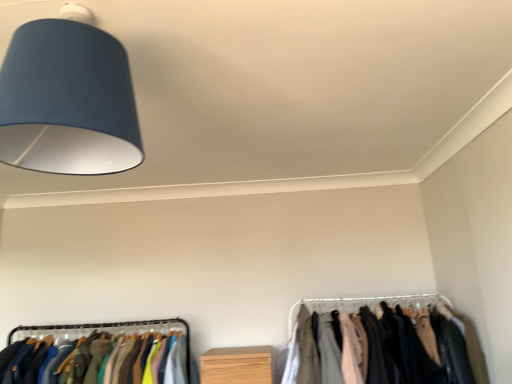
Describe the element at coordinates (378, 346) in the screenshot. I see `silky fabric clothes at lower right` at that location.

Where is `silky fabric clothes at lower right`? This screenshot has height=384, width=512. silky fabric clothes at lower right is located at coordinates (378, 346).

At what (x,y) coordinates should I click in order to perform the action: click on matte blue lampshade at upper left. Please return your answer as a coordinate pair (x, y). Looking at the image, I should click on (68, 99).

The image size is (512, 384). What do you see at coordinates (68, 99) in the screenshot?
I see `matte blue lampshade at upper left` at bounding box center [68, 99].

Find the location of `silky fabric clothes at lower right`. silky fabric clothes at lower right is located at coordinates (378, 346).

Can you confirm if silky fabric clothes at lower right is positioned to the right of matte blue lampshade at upper left?

Indeed, silky fabric clothes at lower right is positioned on the right side of matte blue lampshade at upper left.

Is the position of silky fabric clothes at lower right less distant than that of matte blue lampshade at upper left?

That is False.

Which point is more distant from viewer, (431, 359) or (25, 139)?

Positioned behind is point (431, 359).

From the image's perspective, between silky fabric clothes at lower right and matte blue lampshade at upper left, which one is located above?

From the image's view, matte blue lampshade at upper left is above.

From a real-world perspective, between silky fabric clothes at lower right and matte blue lampshade at upper left, who is vertically higher?

In real-world perspective, matte blue lampshade at upper left is above.

In terms of width, does silky fabric clothes at lower right look wider or thinner when compared to matte blue lampshade at upper left?

silky fabric clothes at lower right is wider than matte blue lampshade at upper left.

Can you confirm if silky fabric clothes at lower right is shorter than matte blue lampshade at upper left?

No, silky fabric clothes at lower right is not shorter than matte blue lampshade at upper left.

Is silky fabric clothes at lower right bigger or smaller than matte blue lampshade at upper left?

silky fabric clothes at lower right is bigger than matte blue lampshade at upper left.

Is silky fabric clothes at lower right inside or outside of matte blue lampshade at upper left?

silky fabric clothes at lower right lies outside matte blue lampshade at upper left.

Are silky fabric clothes at lower right and matte blue lampshade at upper left making contact?

No, silky fabric clothes at lower right is not with matte blue lampshade at upper left.

Is silky fabric clothes at lower right looking in the opposite direction of matte blue lampshade at upper left?

silky fabric clothes at lower right does not have its back to matte blue lampshade at upper left.

How different are the orientations of silky fabric clothes at lower right and matte blue lampshade at upper left in degrees?

silky fabric clothes at lower right and matte blue lampshade at upper left are facing 90 degrees away from each other.

The height and width of the screenshot is (384, 512). Find the location of `closet that is under the matte blue lampshade at upper left (from a real-world perspective)`. closet that is under the matte blue lampshade at upper left (from a real-world perspective) is located at coordinates (378, 346).

In the image, is matte blue lampshade at upper left on the left side or the right side of silky fabric clothes at lower right?

matte blue lampshade at upper left is positioned on silky fabric clothes at lower right's left side.

Which is in front, matte blue lampshade at upper left or silky fabric clothes at lower right?

Positioned in front is matte blue lampshade at upper left.

Does point (40, 146) appear closer or farther from the camera than point (378, 379)?

Point (40, 146) is closer to the camera than point (378, 379).

From the image's perspective, would you say matte blue lampshade at upper left is shown under silky fabric clothes at lower right?

Actually, matte blue lampshade at upper left appears above silky fabric clothes at lower right in the image.

From a real-world perspective, which is physically below, matte blue lampshade at upper left or silky fabric clothes at lower right?

silky fabric clothes at lower right, from a real-world perspective.

Which object is wider, matte blue lampshade at upper left or silky fabric clothes at lower right?

silky fabric clothes at lower right is wider.

Considering the relative sizes of matte blue lampshade at upper left and silky fabric clothes at lower right in the image provided, is matte blue lampshade at upper left taller than silky fabric clothes at lower right?

Incorrect, the height of matte blue lampshade at upper left is not larger of that of silky fabric clothes at lower right.

Is matte blue lampshade at upper left bigger or smaller than silky fabric clothes at lower right?

matte blue lampshade at upper left is smaller than silky fabric clothes at lower right.

Is matte blue lampshade at upper left spatially inside silky fabric clothes at lower right, or outside of it?

matte blue lampshade at upper left is not enclosed by silky fabric clothes at lower right.

Is the surface of matte blue lampshade at upper left in direct contact with silky fabric clothes at lower right?

matte blue lampshade at upper left and silky fabric clothes at lower right are clearly separated.

Based on the photo, is matte blue lampshade at upper left facing away from silky fabric clothes at lower right?

No, matte blue lampshade at upper left's orientation is not away from silky fabric clothes at lower right.

What's the angular difference between matte blue lampshade at upper left and silky fabric clothes at lower right's facing directions?

The angle between the facing direction of matte blue lampshade at upper left and the facing direction of silky fabric clothes at lower right is 90 degrees.

Identify the location of lamp above the silky fabric clothes at lower right (from a real-world perspective). (68, 99).

The image size is (512, 384). In order to click on lamp that is in front of the silky fabric clothes at lower right in this screenshot , I will do `click(68, 99)`.

Where is `lamp that is above the silky fabric clothes at lower right (from the image's perspective)`? This screenshot has width=512, height=384. lamp that is above the silky fabric clothes at lower right (from the image's perspective) is located at coordinates (68, 99).